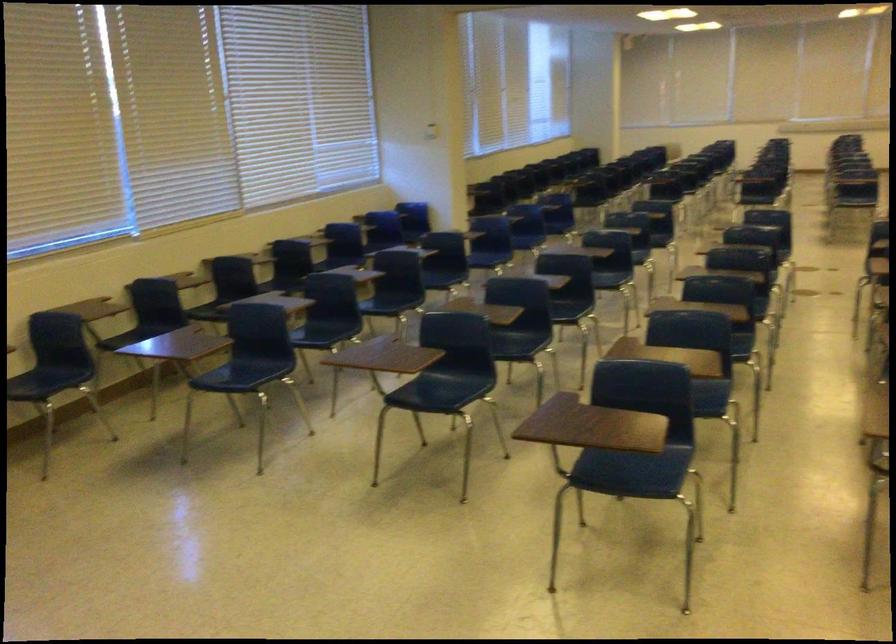
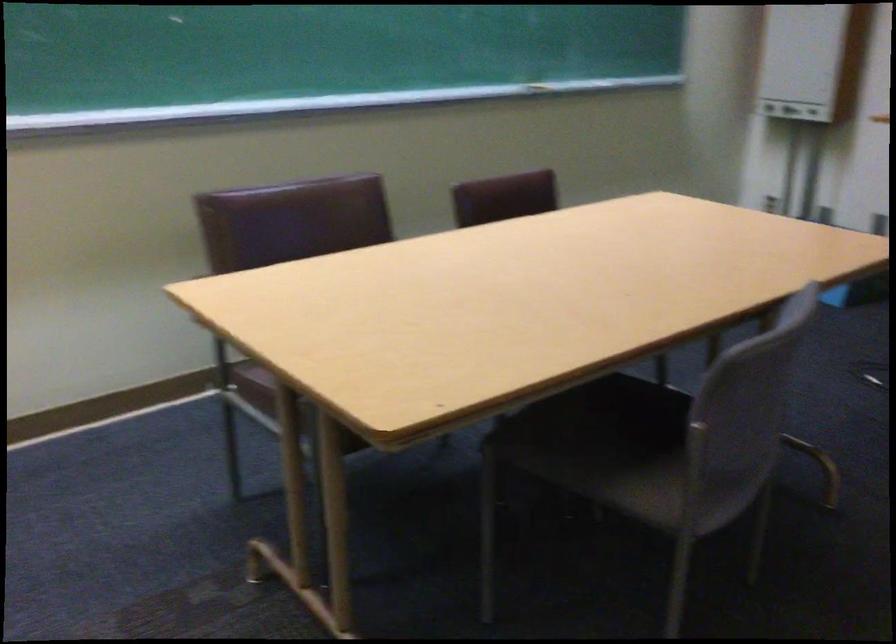
How did the camera likely rotate?

The camera rotated toward left-down.